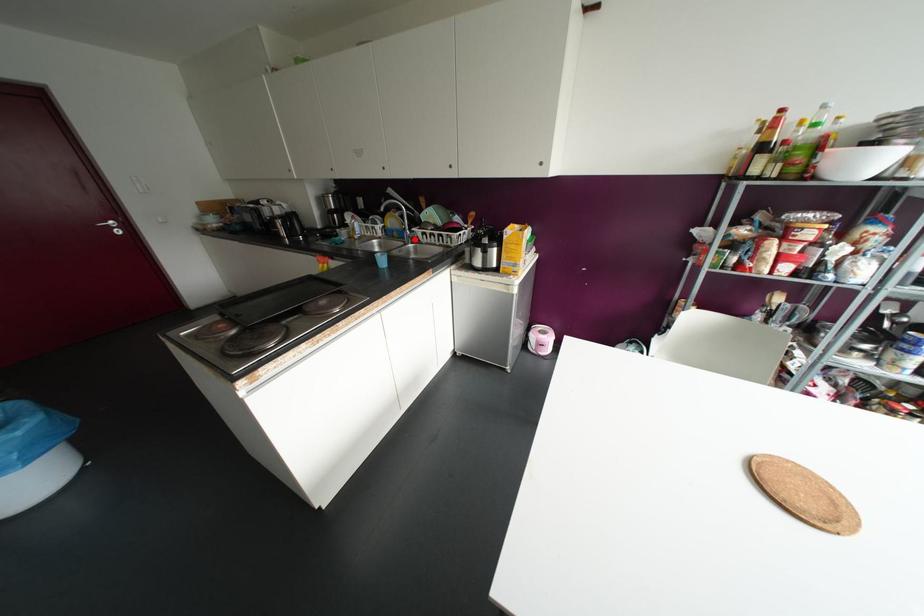
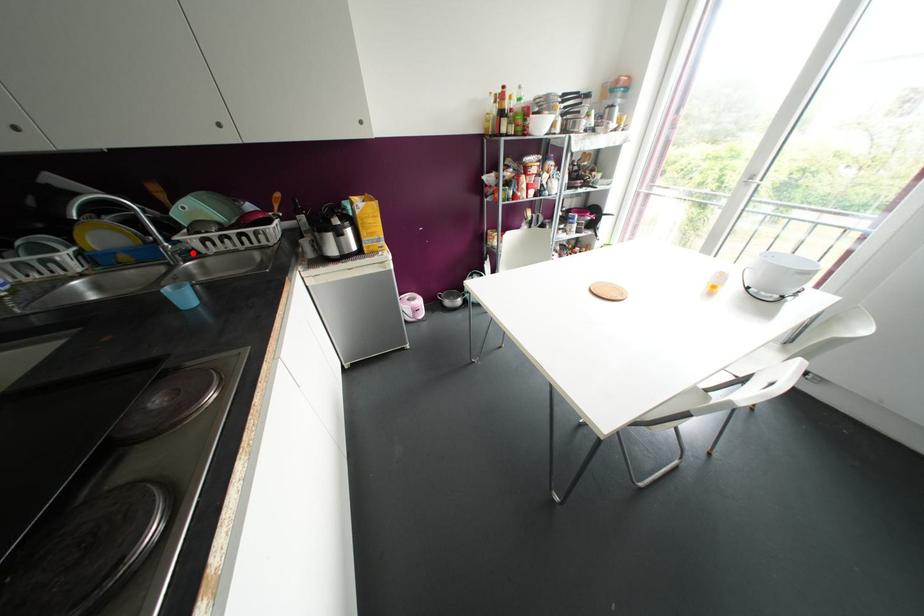
Consider the image. I am providing you with two images of the same scene from different viewpoints. A red point is marked on the first image and another point is marked on the second image. Is the red point in image1 aligned with the point shown in image2?

Yes